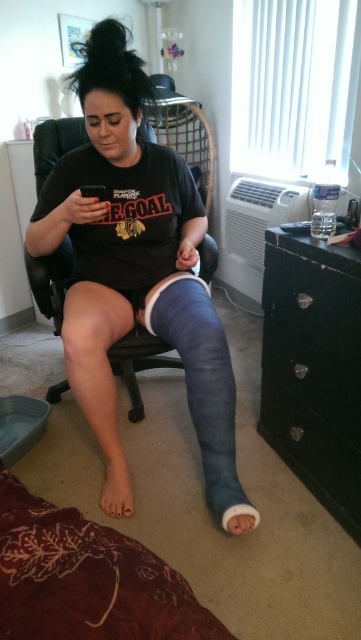
You are a delivery robot trying to navigate to the point marked as point (110, 508). There is an obstacle at point (320, 410). Since you can only move forward and backward, can you safely reach your destination without hitting the obstacle?

Point (320, 410) is closer to the viewer than point (110, 508), so the obstacle is in front of the destination. Therefore, you cannot safely reach the destination without hitting the obstacle.

You are a delivery person trying to place a small package on the black glossy dresser at lower right. However, the white matte cast at lower center is in the way. Can you slide the package onto the dresser without moving the cast?

The black glossy dresser at lower right is positioned over the white matte cast at lower center, meaning they are directly above and below each other. Since the cast is underneath the dresser, you can safely slide the package onto the dresser without disturbing the cast.